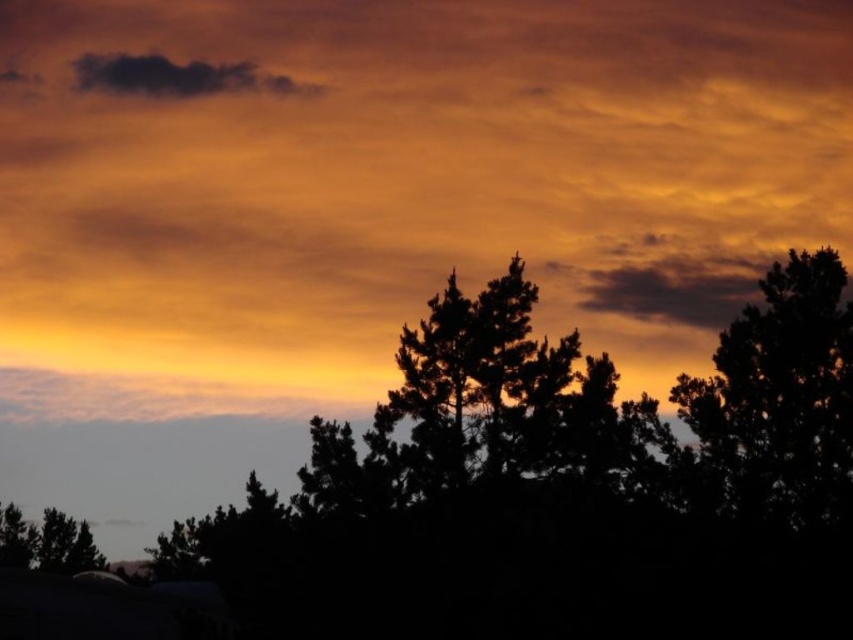
Question: Is the position of silhouette tree at right more distant than that of dark gray cloud at upper left?

Choices:
 (A) yes
 (B) no

Answer: (B)

Question: Does silhouette tree at right have a lesser width compared to dark gray cloud at upper left?

Choices:
 (A) no
 (B) yes

Answer: (B)

Question: Can you confirm if silhouette tree at right is positioned to the right of dark gray cloud at upper left?

Choices:
 (A) yes
 (B) no

Answer: (A)

Question: Among these points, which one is farthest from the camera?

Choices:
 (A) (215, 83)
 (B) (776, 269)

Answer: (A)